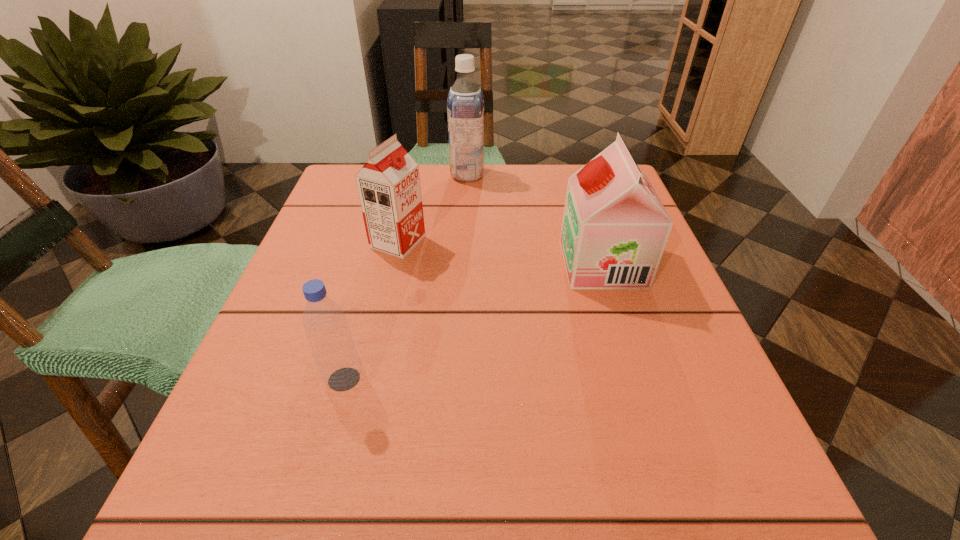
Find the location of a particular element. Image resolution: width=960 pixels, height=540 pixels. vacant area situated 0.230m on the back of the bottle is located at coordinates tap(374, 266).

Where is `object present at the far edge`? This screenshot has width=960, height=540. object present at the far edge is located at coordinates (465, 103).

Where is `soya milk at the left edge`? This screenshot has width=960, height=540. soya milk at the left edge is located at coordinates (388, 185).

The image size is (960, 540). What are the coordinates of `bottle situated at the left edge` in the screenshot? It's located at (335, 354).

Identify the location of object positioned at the right edge. This screenshot has height=540, width=960. (615, 228).

Identify the location of free space at the far edge. The width and height of the screenshot is (960, 540). (529, 193).

This screenshot has height=540, width=960. Identify the location of vacant space at the near edge of the desktop. (356, 473).

The width and height of the screenshot is (960, 540). In the image, there is a desktop. What are the coordinates of `vacant space at the left edge` in the screenshot? It's located at (286, 305).

This screenshot has width=960, height=540. In the image, there is a desktop. Find the location of `vacant space at the far left corner`. vacant space at the far left corner is located at coordinates (353, 193).

At what (x,y) coordinates should I click in order to perform the action: click on free space at the near left corner of the desktop. Please return your answer as a coordinate pair (x, y). The image size is (960, 540). Looking at the image, I should click on (257, 465).